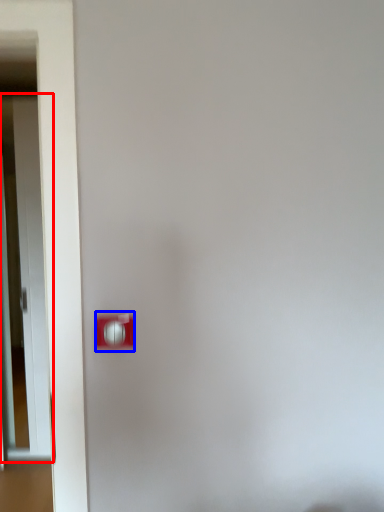
Question: Which object is closer to the camera taking this photo, door (highlighted by a red box) or light switch (highlighted by a blue box)?

Choices:
 (A) door
 (B) light switch

Answer: (B)